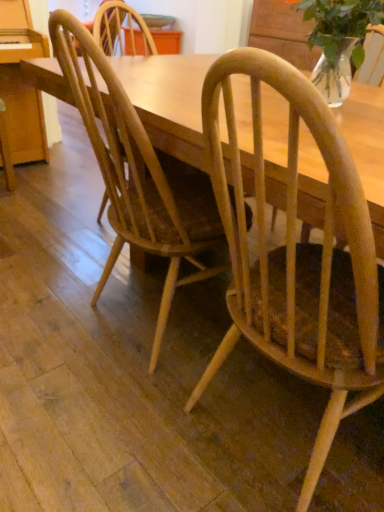
Question: Is clear glass vase at upper right thinner than light brown wood chair at center, which is counted as the first chair, starting from the right?

Choices:
 (A) yes
 (B) no

Answer: (A)

Question: From the image's perspective, is clear glass vase at upper right located above light brown wood chair at center, which appears as the 2th chair when viewed from the left?

Choices:
 (A) no
 (B) yes

Answer: (B)

Question: Would you say clear glass vase at upper right is outside light brown wood chair at center, which appears as the 2th chair when viewed from the left?

Choices:
 (A) yes
 (B) no

Answer: (A)

Question: Is light brown wood chair at center, which is counted as the first chair, starting from the right, completely or partially inside clear glass vase at upper right?

Choices:
 (A) yes
 (B) no

Answer: (B)

Question: Is clear glass vase at upper right shorter than light brown wood chair at center, which is counted as the first chair, starting from the right?

Choices:
 (A) yes
 (B) no

Answer: (A)

Question: Is clear glass vase at upper right taller than light brown wood chair at center, which appears as the 2th chair when viewed from the left?

Choices:
 (A) no
 (B) yes

Answer: (A)

Question: Can you confirm if clear glass vase at upper right is wider than natural wood chair at center, which is the 1th chair in left-to-right order?

Choices:
 (A) no
 (B) yes

Answer: (A)

Question: Are clear glass vase at upper right and natural wood chair at center, marked as the 2th chair in a right-to-left arrangement, located far from each other?

Choices:
 (A) yes
 (B) no

Answer: (B)

Question: Is clear glass vase at upper right taller than natural wood chair at center, marked as the 2th chair in a right-to-left arrangement?

Choices:
 (A) yes
 (B) no

Answer: (B)

Question: Is the depth of clear glass vase at upper right less than that of natural wood chair at center, which is the 1th chair in left-to-right order?

Choices:
 (A) no
 (B) yes

Answer: (A)

Question: Is clear glass vase at upper right thinner than natural wood chair at center, which is the 1th chair in left-to-right order?

Choices:
 (A) yes
 (B) no

Answer: (A)

Question: Is clear glass vase at upper right surrounding natural wood chair at center, which is the 1th chair in left-to-right order?

Choices:
 (A) no
 (B) yes

Answer: (A)

Question: Does natural wood chair at center, which is the 1th chair in left-to-right order, have a lesser width compared to light brown wood chair at center, which appears as the 2th chair when viewed from the left?

Choices:
 (A) yes
 (B) no

Answer: (A)